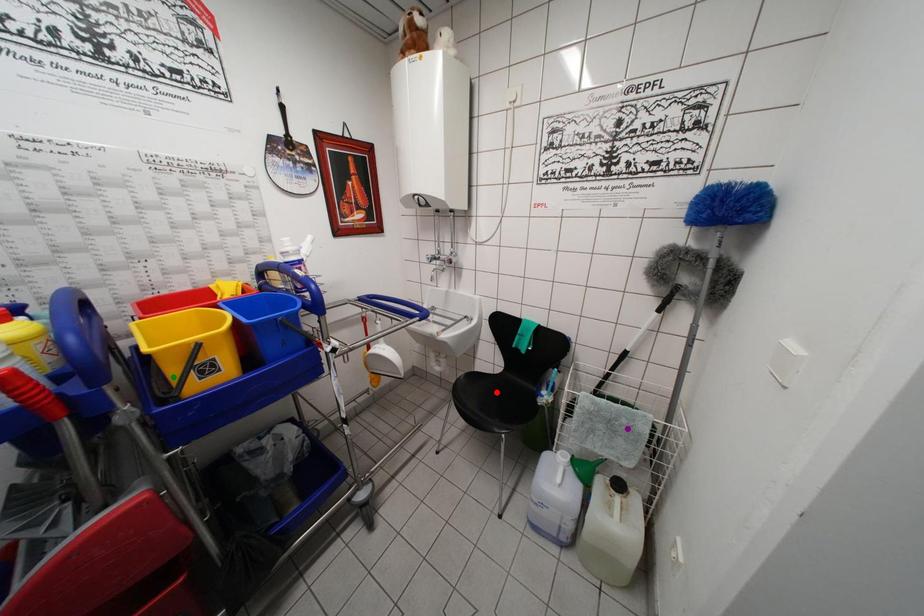
Order these from nearest to farthest:
green point | purple point | red point

1. green point
2. purple point
3. red point